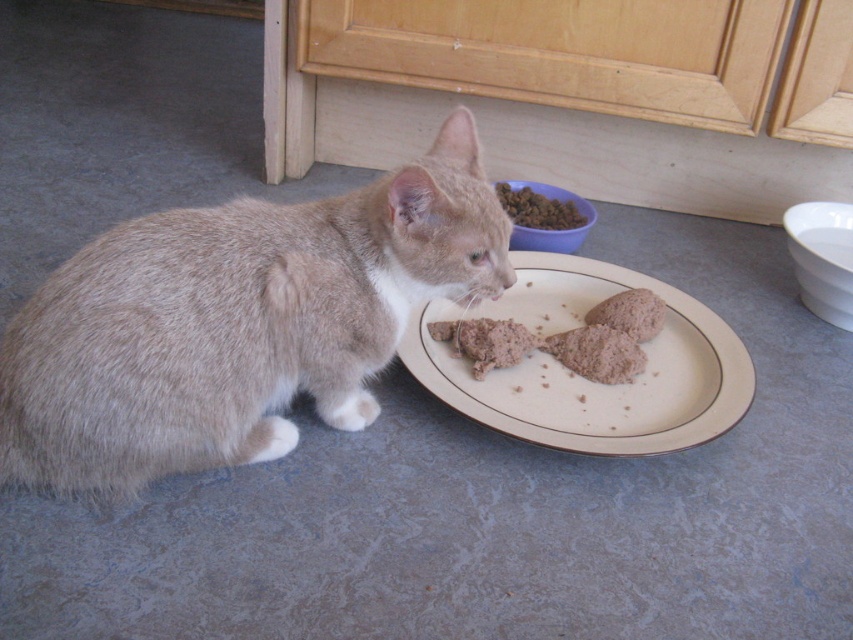
You are a cat owner who wants to ensure your cat can easily access its food. Given the scene, where is the beige ceramic plate at center in relation to the dry kibble at upper center?

The beige ceramic plate at center is located below the dry kibble at upper center, so the cat can easily reach the plate since it is positioned lower than the kibble.

You are a cat owner who wants to ensure your cat can reach its food. The cat is 20 centimeters tall. Can the cat reach the brown textured food at plate center if the plate is on the bluegray countertop?

The brown textured food at plate center and camera are 1.23 meters apart. The cat is 20 centimeters tall, so it can easily reach the food as the distance between them is over a meter, but the height of the countertop isn